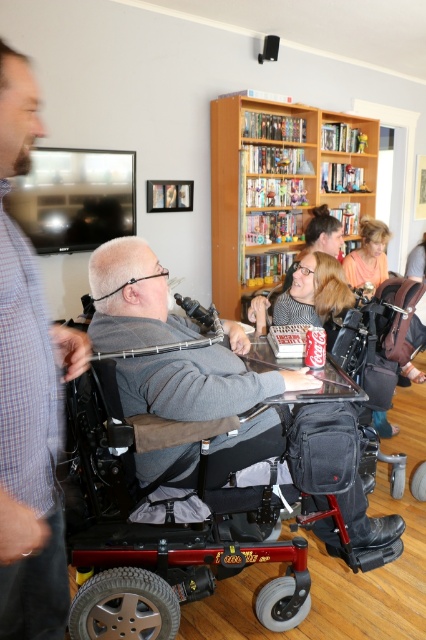
Question: Does gray plaid shirt at left have a greater width compared to gray fabric wheelchair at center?

Choices:
 (A) no
 (B) yes

Answer: (A)

Question: Which object is closer to the camera taking this photo?

Choices:
 (A) gray fabric wheelchair at center
 (B) wooden bookshelf at upper center
 (C) gray plaid shirt at left

Answer: (C)

Question: Which of these objects is positioned farthest from the gray fabric wheelchair at center?

Choices:
 (A) gray plaid shirt at left
 (B) wooden bookshelf at upper center

Answer: (B)

Question: Can you confirm if gray plaid shirt at left is smaller than wooden bookshelf at upper center?

Choices:
 (A) no
 (B) yes

Answer: (B)

Question: Does gray fabric wheelchair at center lie behind wooden bookshelf at upper center?

Choices:
 (A) no
 (B) yes

Answer: (A)

Question: Among these points, which one is farthest from the camera?

Choices:
 (A) (51, 436)
 (B) (126, 321)

Answer: (B)